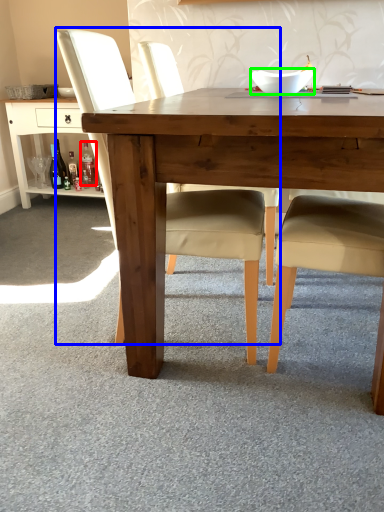
Question: Based on their relative distances, which object is farther from bottle (highlighted by a red box)? Choose from chair (highlighted by a blue box) and bowl (highlighted by a green box).

Choices:
 (A) chair
 (B) bowl

Answer: (A)